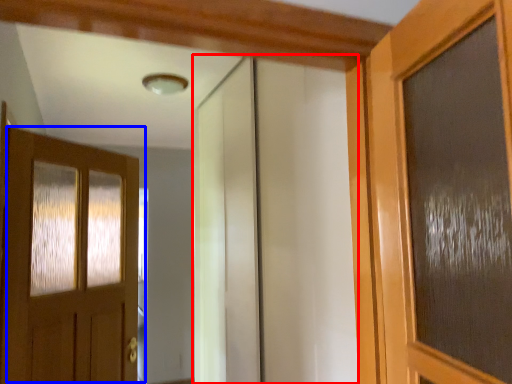
Question: Which of the following is the closest to the observer, elevator (highlighted by a red box) or door (highlighted by a blue box)?

Choices:
 (A) elevator
 (B) door

Answer: (A)